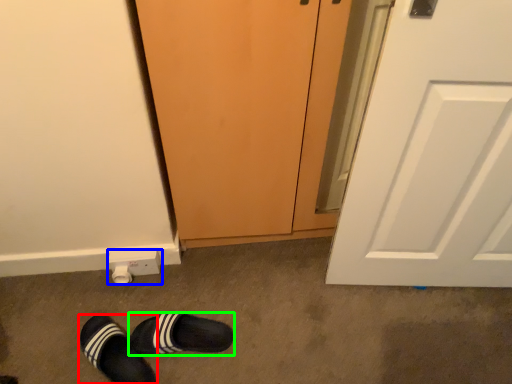
Question: Based on their relative distances, which object is nearer to footwear (highlighted by a red box)? Choose from electric outlet (highlighted by a blue box) and footwear (highlighted by a green box).

Choices:
 (A) electric outlet
 (B) footwear

Answer: (B)